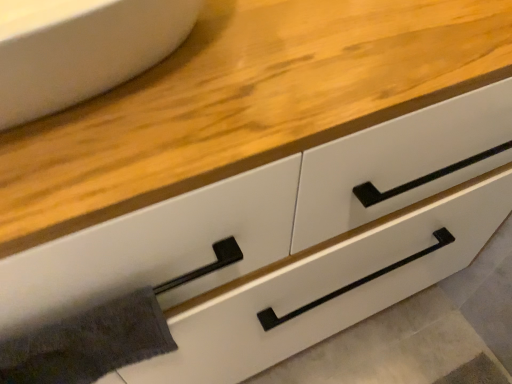
I want to click on gray textured towel at lower left, so click(88, 343).

This screenshot has height=384, width=512. Describe the element at coordinates (88, 343) in the screenshot. I see `gray textured towel at lower left` at that location.

Where is `gray textured towel at lower left`? gray textured towel at lower left is located at coordinates (88, 343).